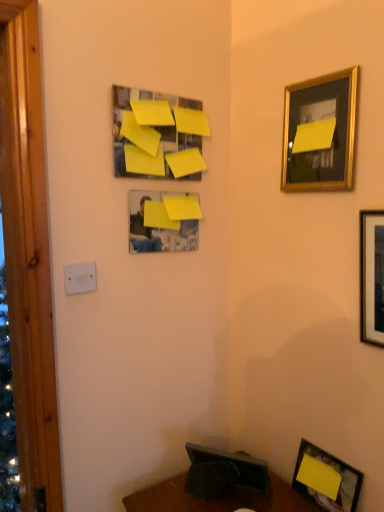
Question: From the image's perspective, is yellow matte picture frame at upper center, which is the 4th picture frame from right to left, below yellow matte paper at lower right, the 4th picture frame viewed from the left?

Choices:
 (A) no
 (B) yes

Answer: (A)

Question: Could yellow matte paper at lower right, the 4th picture frame viewed from the left, be considered to be inside yellow matte picture frame at upper center, which is the 4th picture frame from right to left?

Choices:
 (A) no
 (B) yes

Answer: (A)

Question: Does yellow matte picture frame at upper center, which is the 4th picture frame from right to left, appear on the right side of yellow matte paper at lower right, which is the 1th picture frame from bottom to top?

Choices:
 (A) no
 (B) yes

Answer: (A)

Question: Is yellow matte picture frame at upper center, which ranks as the 3th picture frame in bottom-to-top order, not close to yellow matte paper at lower right, which is the 1th picture frame from bottom to top?

Choices:
 (A) no
 (B) yes

Answer: (A)

Question: From a real-world perspective, does yellow matte picture frame at upper center, which is the 4th picture frame from right to left, stand above yellow matte paper at lower right, the fifth picture frame viewed from the top?

Choices:
 (A) no
 (B) yes

Answer: (B)

Question: Considering the positions of white plastic/light switch at lower left and wooden framed picture at right, which is the fifth picture frame in left-to-right order, in the image, is white plastic/light switch at lower left bigger or smaller than wooden framed picture at right, which is the fifth picture frame in left-to-right order,?

Choices:
 (A) small
 (B) big

Answer: (A)

Question: Is point (87, 280) closer or farther from the camera than point (374, 281)?

Choices:
 (A) closer
 (B) farther

Answer: (B)

Question: From a real-world perspective, is white plastic/light switch at lower left above or below wooden framed picture at right, which is the 1th picture frame in right-to-left order?

Choices:
 (A) above
 (B) below

Answer: (B)

Question: Is white plastic/light switch at lower left to the left or to the right of wooden framed picture at right, which is the fifth picture frame in left-to-right order, in the image?

Choices:
 (A) left
 (B) right

Answer: (A)

Question: Is yellow paper at upper center, the 1th picture frame viewed from the left, taller or shorter than yellow matte picture frame at upper center, the 3th picture frame positioned from the top?

Choices:
 (A) tall
 (B) short

Answer: (A)

Question: From the image's perspective, is yellow paper at upper center, the 1th picture frame viewed from the left, located above or below yellow matte picture frame at upper center, which ranks as the 3th picture frame in bottom-to-top order?

Choices:
 (A) above
 (B) below

Answer: (A)

Question: Is point (175, 119) positioned closer to the camera than point (165, 193)?

Choices:
 (A) farther
 (B) closer

Answer: (B)

Question: Is yellow paper at upper center, positioned as the first picture frame in top-to-bottom order, situated inside yellow matte picture frame at upper center, which ranks as the 3th picture frame in bottom-to-top order, or outside?

Choices:
 (A) inside
 (B) outside

Answer: (B)

Question: Is white plastic/light switch at lower left to the left or to the right of gold metallic picture frame at upper right, the 4th picture frame from the bottom, in the image?

Choices:
 (A) right
 (B) left

Answer: (B)

Question: From the image's perspective, is white plastic/light switch at lower left above or below gold metallic picture frame at upper right, arranged as the third picture frame when viewed from the right?

Choices:
 (A) above
 (B) below

Answer: (B)